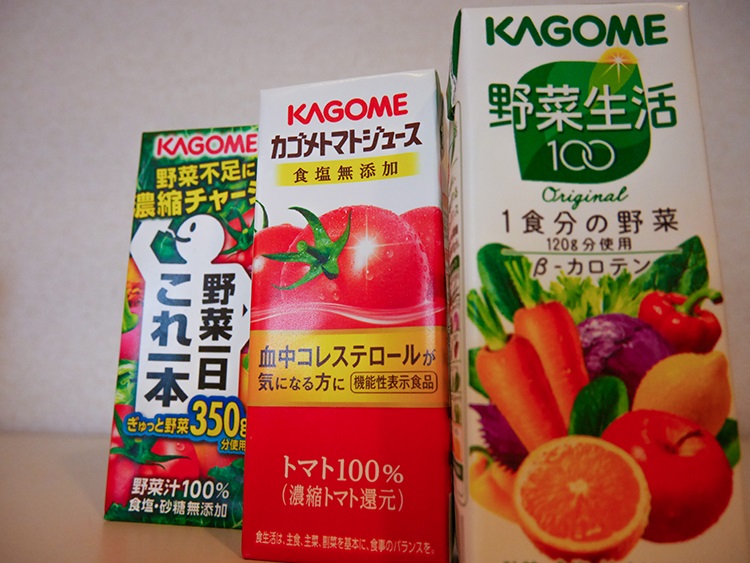
Find the location of `wall`. wall is located at coordinates (57, 311).